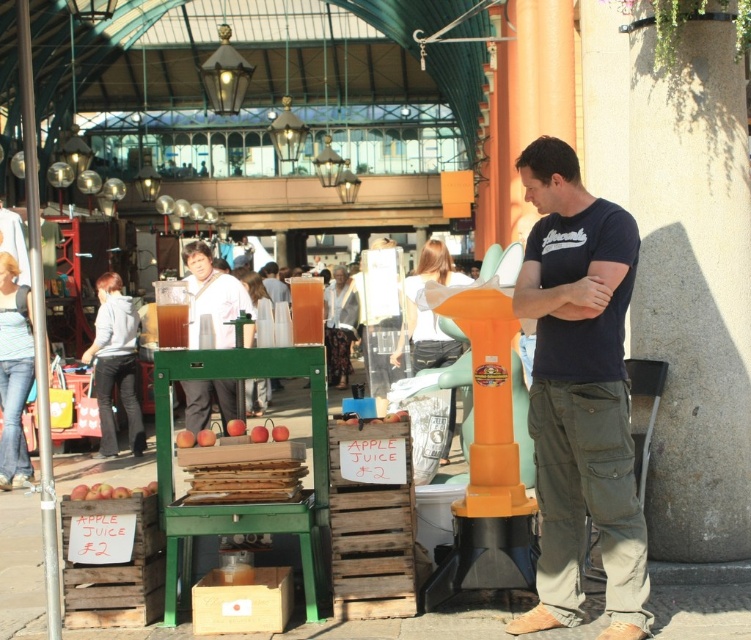
Question: Is dark blue t-shirt at center to the right of white matte jacket at center from the viewer's perspective?

Choices:
 (A) no
 (B) yes

Answer: (B)

Question: Does dark blue t-shirt at center come in front of white matte jacket at center?

Choices:
 (A) yes
 (B) no

Answer: (A)

Question: Can you confirm if dark blue t-shirt at center is wider than white matte jacket at center?

Choices:
 (A) yes
 (B) no

Answer: (A)